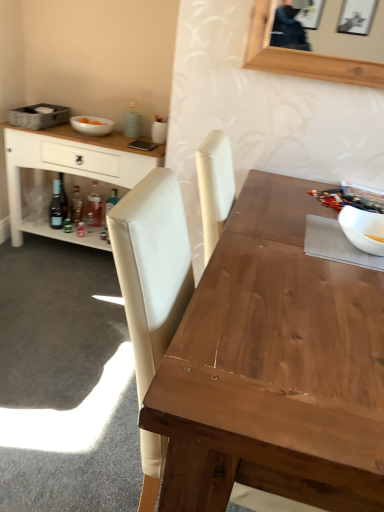
Question: Is wooden table at center not near translucent glass bottle at lower left, the second bottle viewed from the right?

Choices:
 (A) no
 (B) yes

Answer: (B)

Question: Could you tell me if wooden table at center is facing translucent glass bottle at lower left, the second bottle viewed from the right?

Choices:
 (A) yes
 (B) no

Answer: (B)

Question: Does wooden table at center contain translucent glass bottle at lower left, marked as the second bottle in a left-to-right arrangement?

Choices:
 (A) yes
 (B) no

Answer: (B)

Question: Considering the relative sizes of wooden table at center and translucent glass bottle at lower left, the second bottle viewed from the right, in the image provided, is wooden table at center wider than translucent glass bottle at lower left, the second bottle viewed from the right,?

Choices:
 (A) yes
 (B) no

Answer: (A)

Question: Is wooden table at center bigger than translucent glass bottle at lower left, marked as the second bottle in a left-to-right arrangement?

Choices:
 (A) no
 (B) yes

Answer: (B)

Question: In terms of size, does matte glass bottle at lower left, the third bottle positioned from the right, appear bigger or smaller than gray woven picnic basket at upper left?

Choices:
 (A) big
 (B) small

Answer: (B)

Question: Would you say matte glass bottle at lower left, marked as the first bottle in a left-to-right arrangement, is inside or outside gray woven picnic basket at upper left?

Choices:
 (A) inside
 (B) outside

Answer: (B)

Question: In the image, is matte glass bottle at lower left, marked as the first bottle in a left-to-right arrangement, positioned in front of or behind gray woven picnic basket at upper left?

Choices:
 (A) behind
 (B) front

Answer: (A)

Question: Is matte glass bottle at lower left, marked as the first bottle in a left-to-right arrangement, to the left or to the right of gray woven picnic basket at upper left in the image?

Choices:
 (A) left
 (B) right

Answer: (B)

Question: Is matte glass bottle at lower left, marked as the first bottle in a left-to-right arrangement, situated inside translucent glass bottle at lower left, marked as the second bottle in a left-to-right arrangement, or outside?

Choices:
 (A) outside
 (B) inside

Answer: (A)

Question: In terms of height, does matte glass bottle at lower left, the third bottle positioned from the right, look taller or shorter compared to translucent glass bottle at lower left, marked as the second bottle in a left-to-right arrangement?

Choices:
 (A) tall
 (B) short

Answer: (A)

Question: From the image's perspective, relative to translucent glass bottle at lower left, the second bottle viewed from the right, is matte glass bottle at lower left, marked as the first bottle in a left-to-right arrangement, above or below?

Choices:
 (A) above
 (B) below

Answer: (A)

Question: Looking at their shapes, would you say matte glass bottle at lower left, the third bottle positioned from the right, is wider or thinner than translucent glass bottle at lower left, the second bottle viewed from the right?

Choices:
 (A) thin
 (B) wide

Answer: (A)

Question: Is translucent glass bottle at lower left, which is counted as the first bottle, starting from the right, taller or shorter than translucent glass bottle at lower left, marked as the second bottle in a left-to-right arrangement?

Choices:
 (A) short
 (B) tall

Answer: (B)

Question: Based on their positions, is translucent glass bottle at lower left, which appears as the 3th bottle when viewed from the left, located to the left or right of translucent glass bottle at lower left, the second bottle viewed from the right?

Choices:
 (A) left
 (B) right

Answer: (B)